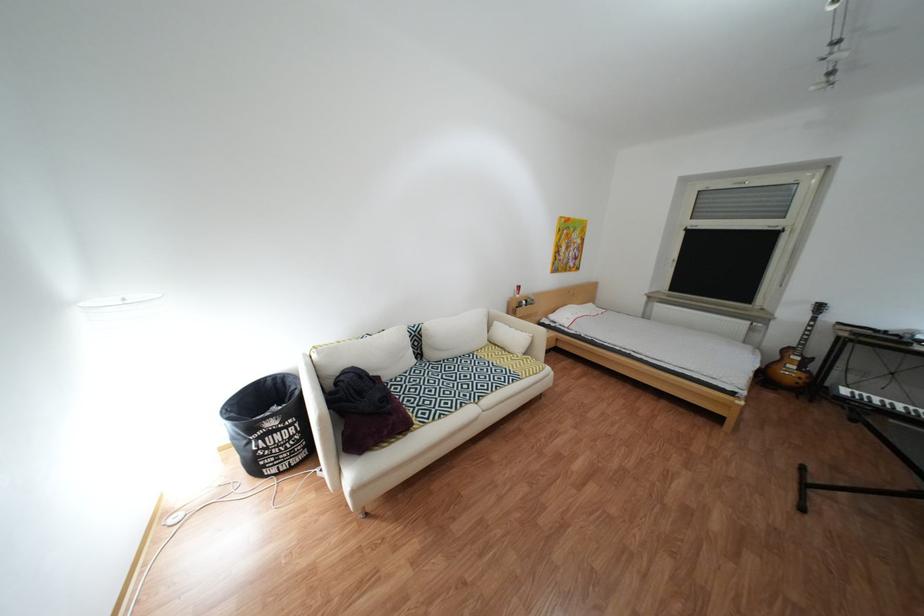
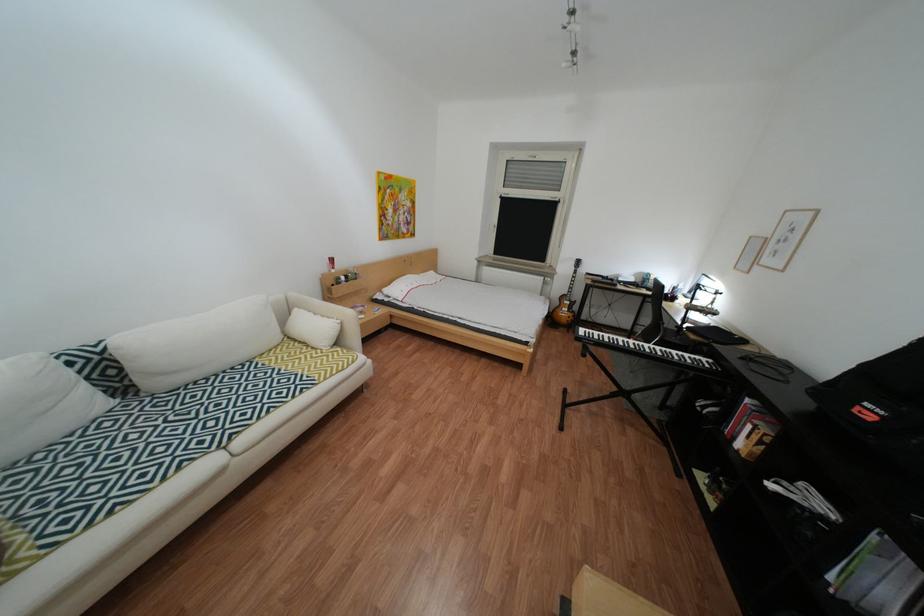
What movement of the cameraman would produce the second image?

The cameraman moved toward right, forward.